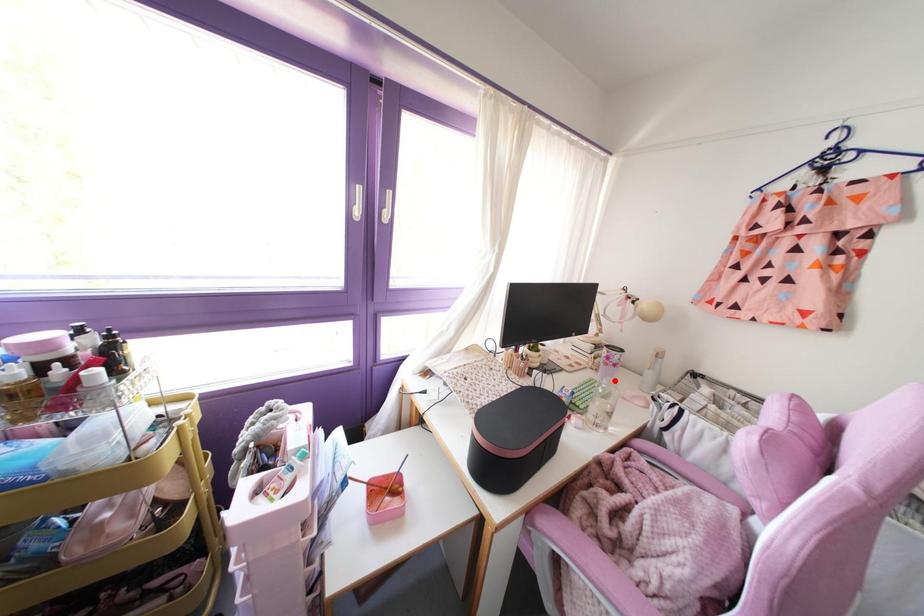
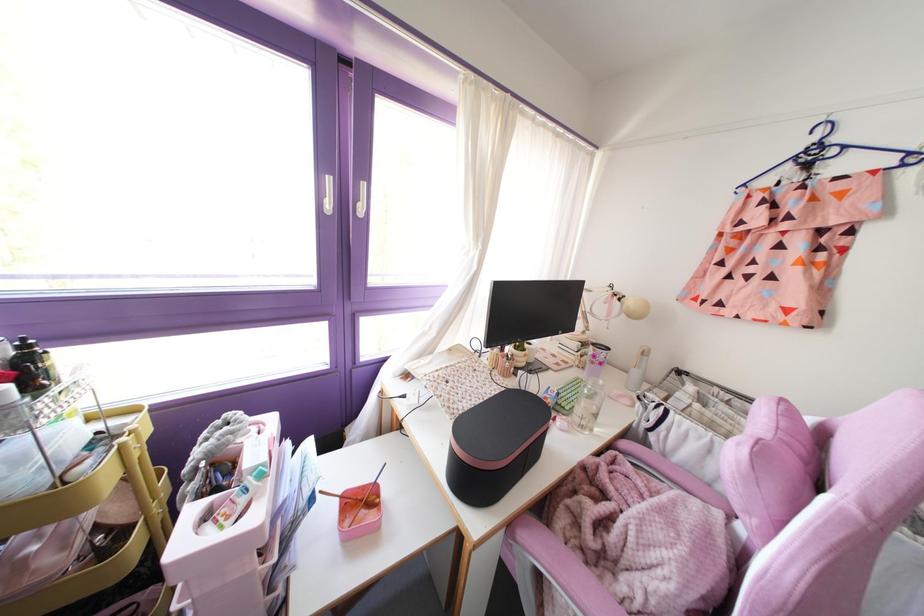
In the second image, find the point that corresponds to the highlighted location in the first image.

(601, 382)